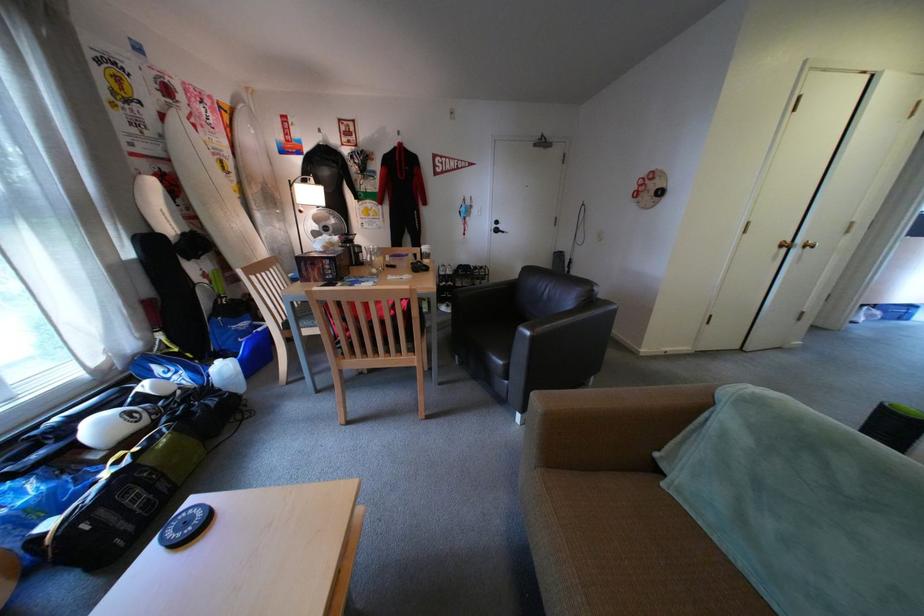
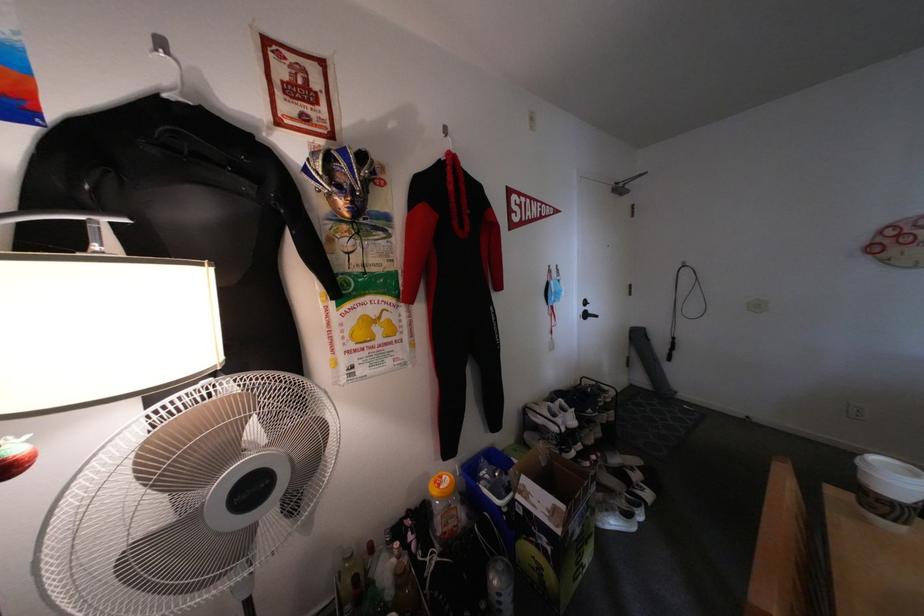
Where in the second image is the point corresponding to point (390, 180) from the first image?

(404, 237)